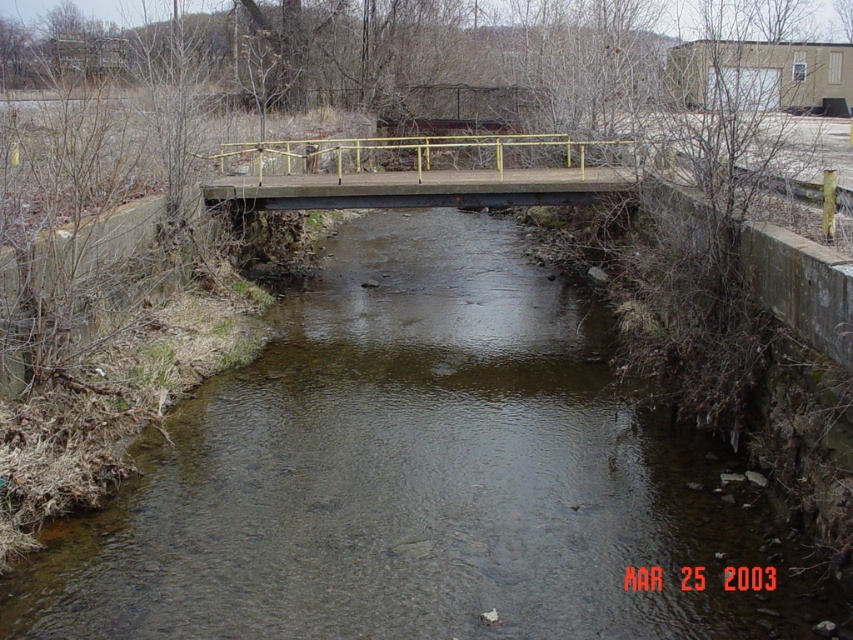
You are standing on the matte concrete bridge at center and want to cross to the other side. Which direction should you walk to avoid stepping into the clear water at center?

You should walk to the left side of the matte concrete bridge at center to avoid stepping into the clear water at center, as the clear water at center is positioned on the right side of the matte concrete bridge at center.